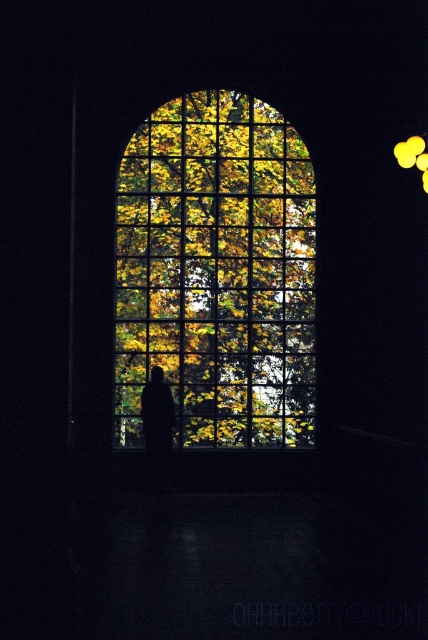
Is black matte figure at center thinner than yellow matte light at upper right?

No, black matte figure at center is not thinner than yellow matte light at upper right.

Does black matte figure at center lie in front of yellow matte light at upper right?

That is False.

Who is more forward, (x=151, y=442) or (x=406, y=140)?

Point (x=406, y=140)

Find the location of a particular element. This screenshot has height=640, width=428. black matte figure at center is located at coordinates coord(157,413).

Does translucent glass window at center appear under yellow matte light at upper right?

Correct, translucent glass window at center is located below yellow matte light at upper right.

Is translucent glass window at center bigger than yellow matte light at upper right?

Indeed, translucent glass window at center has a larger size compared to yellow matte light at upper right.

Is point (276, 400) positioned behind point (395, 157)?

That is True.

Locate an element on the screen. The height and width of the screenshot is (640, 428). translucent glass window at center is located at coordinates (216, 273).

Is point (312, 346) less distant than point (148, 440)?

No, it is not.

Can you confirm if translucent glass window at center is positioned below black matte figure at center?

No.

Who is more forward, (x=279, y=230) or (x=151, y=396)?

Positioned in front is point (x=151, y=396).

Where is `translucent glass window at center`? The height and width of the screenshot is (640, 428). translucent glass window at center is located at coordinates (216, 273).